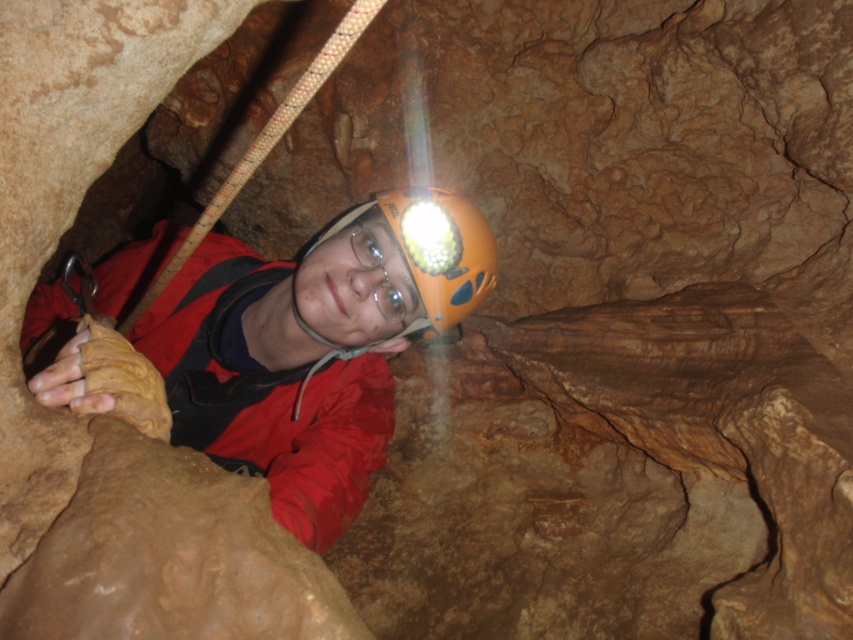
Consider the image. Does matte orange helmet at center have a smaller size compared to orange matte helmet at center?

No, matte orange helmet at center is not smaller than orange matte helmet at center.

Is matte orange helmet at center positioned at the back of orange matte helmet at center?

No.

The width and height of the screenshot is (853, 640). Describe the element at coordinates (289, 349) in the screenshot. I see `matte orange helmet at center` at that location.

The width and height of the screenshot is (853, 640). In order to click on matte orange helmet at center in this screenshot , I will do `click(289, 349)`.